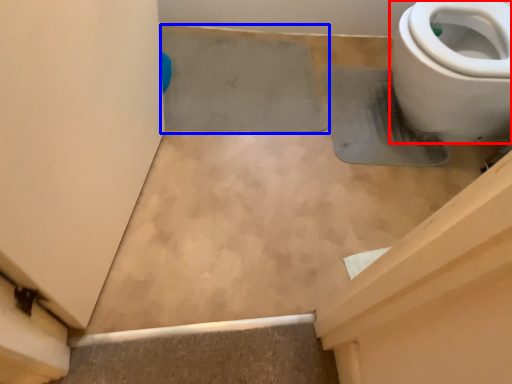
Question: Which object appears closest to the camera in this image, toilet (highlighted by a red box) or concrete (highlighted by a blue box)?

Choices:
 (A) toilet
 (B) concrete

Answer: (A)